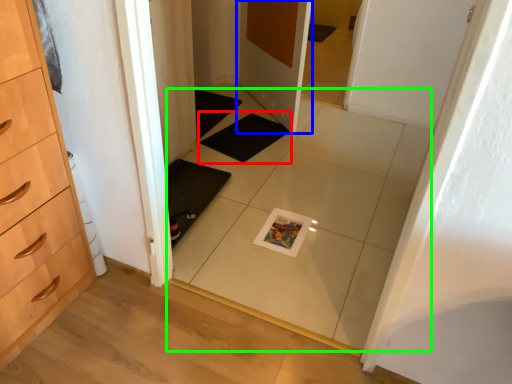
Question: Which is nearer to the bath mat (highlighted by a red box)? door (highlighted by a blue box) or tile (highlighted by a green box).

Choices:
 (A) door
 (B) tile

Answer: (A)